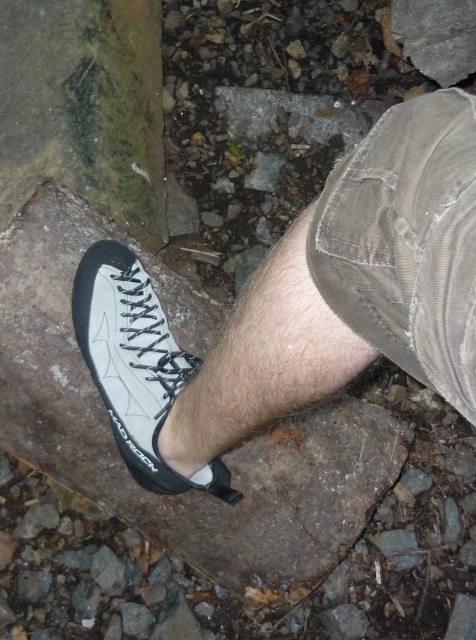
Question: Estimate the real-world distances between objects in this image. Which object is closer to the smooth gray rock at center?

Choices:
 (A) white matte climbing shoe at center
 (B) white leather shoe at center

Answer: (A)

Question: Is white leather shoe at center further to the viewer compared to smooth gray rock at center?

Choices:
 (A) no
 (B) yes

Answer: (A)

Question: Which point appears farthest from the camera in this image?

Choices:
 (A) (175, 531)
 (B) (226, 413)
 (C) (170, 484)

Answer: (A)

Question: Is white leather shoe at center below smooth gray rock at center?

Choices:
 (A) no
 (B) yes

Answer: (A)

Question: Is white leather shoe at center to the right of smooth gray rock at center from the viewer's perspective?

Choices:
 (A) yes
 (B) no

Answer: (A)

Question: Estimate the real-world distances between objects in this image. Which object is closer to the smooth gray rock at center?

Choices:
 (A) white leather shoe at center
 (B) white matte climbing shoe at center

Answer: (B)